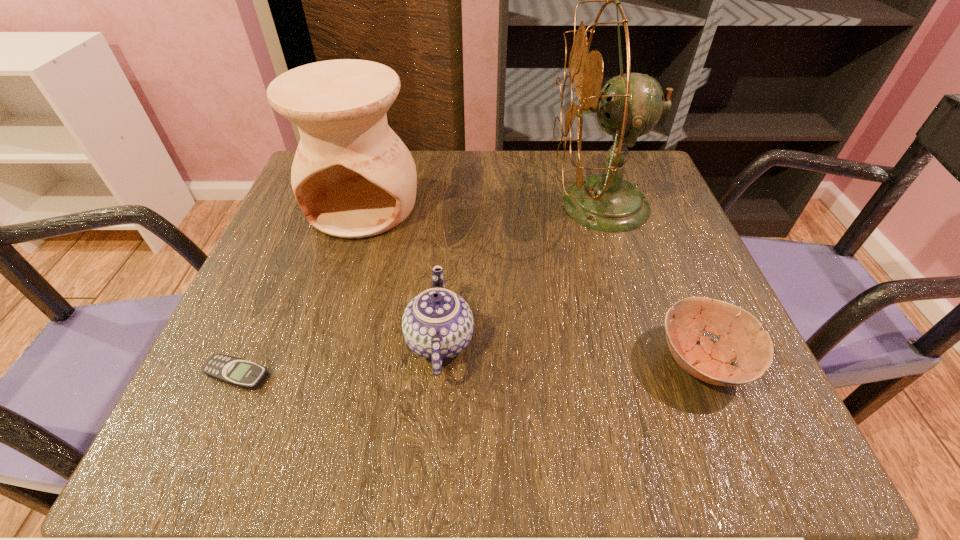
Identify the location of fan. This screenshot has height=540, width=960. (630, 105).

This screenshot has height=540, width=960. In order to click on the fourth shortest object in this screenshot , I will do pyautogui.click(x=353, y=177).

Identify the location of the third object from left to right. This screenshot has width=960, height=540. (437, 324).

This screenshot has width=960, height=540. In order to click on the third tallest object in this screenshot , I will do `click(437, 324)`.

The image size is (960, 540). Identify the location of bowl. (740, 337).

Locate an element on the screen. This screenshot has width=960, height=540. beeper is located at coordinates (238, 372).

Identify the location of free spot located 0.050m in front of the tallest object, directing air flow. (530, 205).

The height and width of the screenshot is (540, 960). In order to click on vacant space located 0.280m in front of the tallest object, directing air flow in this screenshot , I will do pyautogui.click(x=427, y=205).

Identify the location of vacant space located in front of the tallest object, directing air flow. (512, 205).

Where is `blank space located at the open side of the pottery`? The width and height of the screenshot is (960, 540). blank space located at the open side of the pottery is located at coordinates (297, 422).